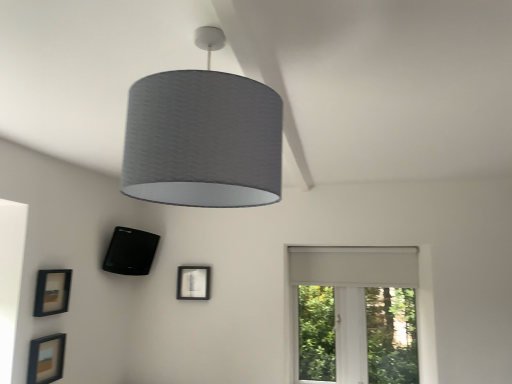
Question: From a real-world perspective, is matte black picture frame at lower left, the 2th picture frame positioned from the back, under textured gray lampshade at center?

Choices:
 (A) no
 (B) yes

Answer: (B)

Question: Is matte black picture frame at lower left, placed as the 2th picture frame when sorted from right to left, wider than textured gray lampshade at center?

Choices:
 (A) yes
 (B) no

Answer: (B)

Question: From the image's perspective, is matte black picture frame at lower left, placed as the 2th picture frame when sorted from right to left, on textured gray lampshade at center?

Choices:
 (A) yes
 (B) no

Answer: (B)

Question: Is matte black picture frame at lower left, placed as the 2th picture frame when sorted from right to left, further to the viewer compared to textured gray lampshade at center?

Choices:
 (A) yes
 (B) no

Answer: (A)

Question: Does matte black picture frame at lower left, placed as the 2th picture frame when sorted from right to left, have a lesser width compared to textured gray lampshade at center?

Choices:
 (A) no
 (B) yes

Answer: (B)

Question: Is matte black picture frame at lower left, marked as the 2th picture frame in a left-to-right arrangement, facing away from textured gray lampshade at center?

Choices:
 (A) no
 (B) yes

Answer: (A)

Question: Can you confirm if textured gray lampshade at center is wider than white matte window at right?

Choices:
 (A) no
 (B) yes

Answer: (B)

Question: Is textured gray lampshade at center positioned in front of white matte window at right?

Choices:
 (A) yes
 (B) no

Answer: (A)

Question: Is textured gray lampshade at center at the left side of white matte window at right?

Choices:
 (A) yes
 (B) no

Answer: (A)

Question: Is textured gray lampshade at center not within white matte window at right?

Choices:
 (A) no
 (B) yes

Answer: (B)

Question: Is white matte window at right at the back of textured gray lampshade at center?

Choices:
 (A) no
 (B) yes

Answer: (B)

Question: Is white matte window at right located within textured gray lampshade at center?

Choices:
 (A) yes
 (B) no

Answer: (B)

Question: Does black matte speaker at lower left, the first picture frame viewed from the back, lie in front of white matte window at right?

Choices:
 (A) no
 (B) yes

Answer: (B)